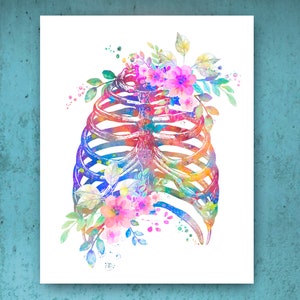
The image size is (300, 300). In order to click on blue wall above art in this screenshot , I will do `click(143, 10)`.